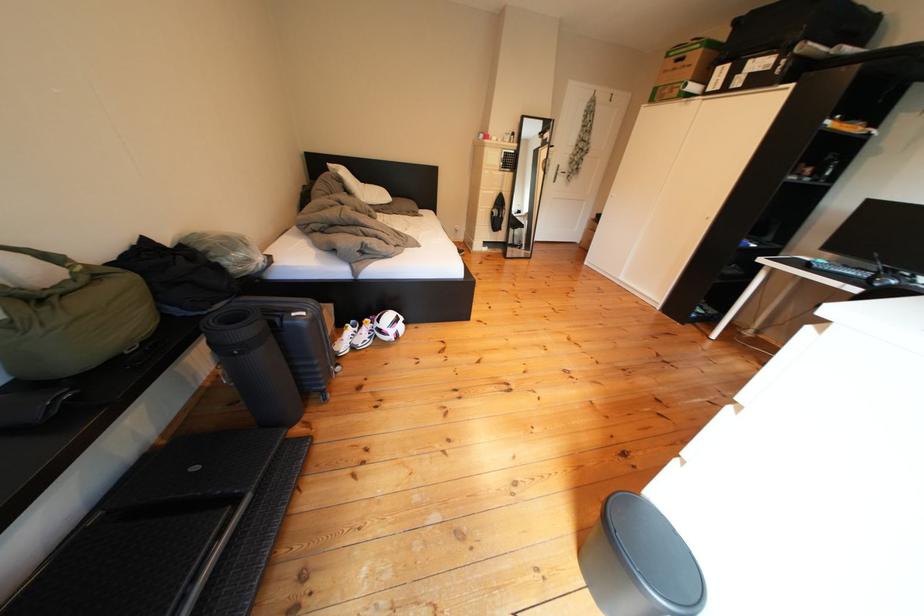
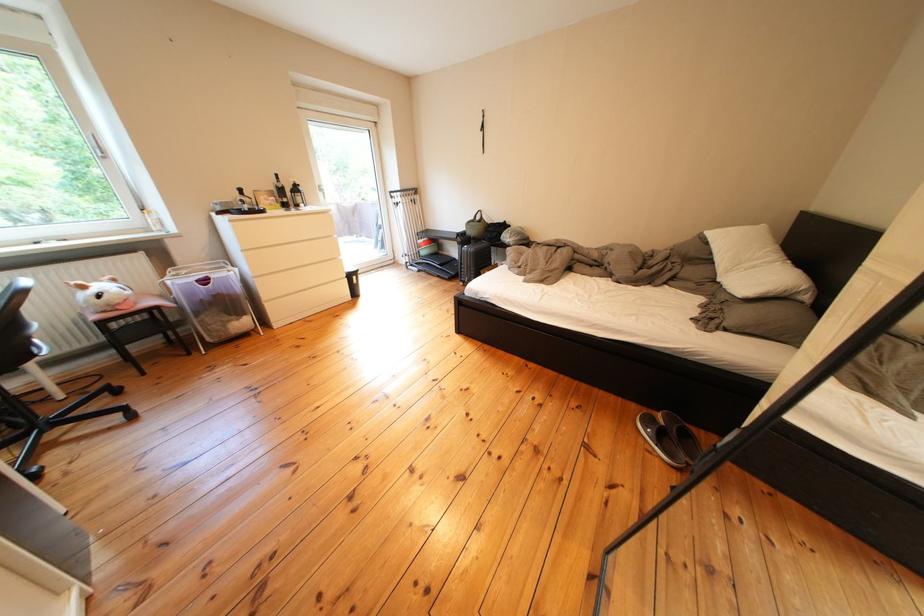
Locate, in the second image, the point that corresponds to (317,318) in the first image.

(479, 252)